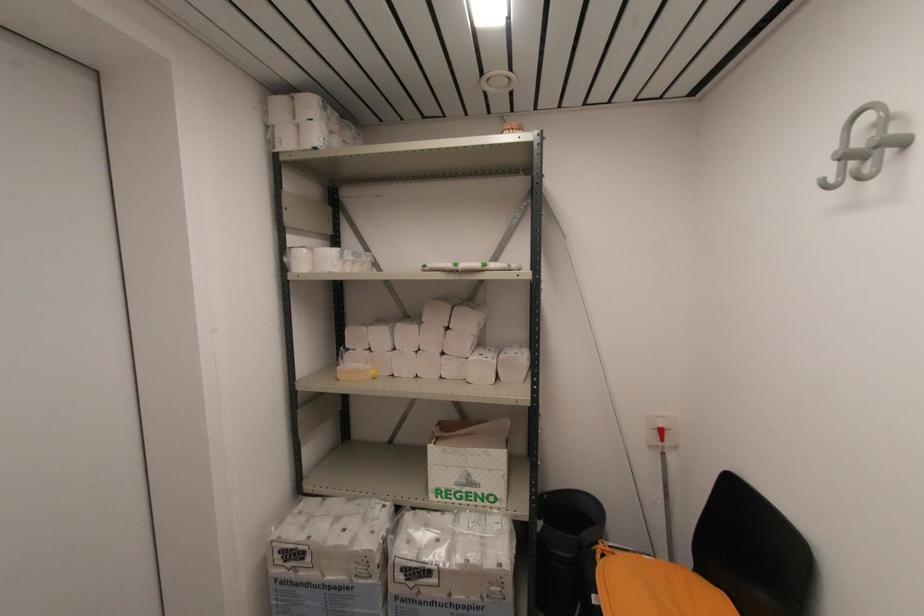
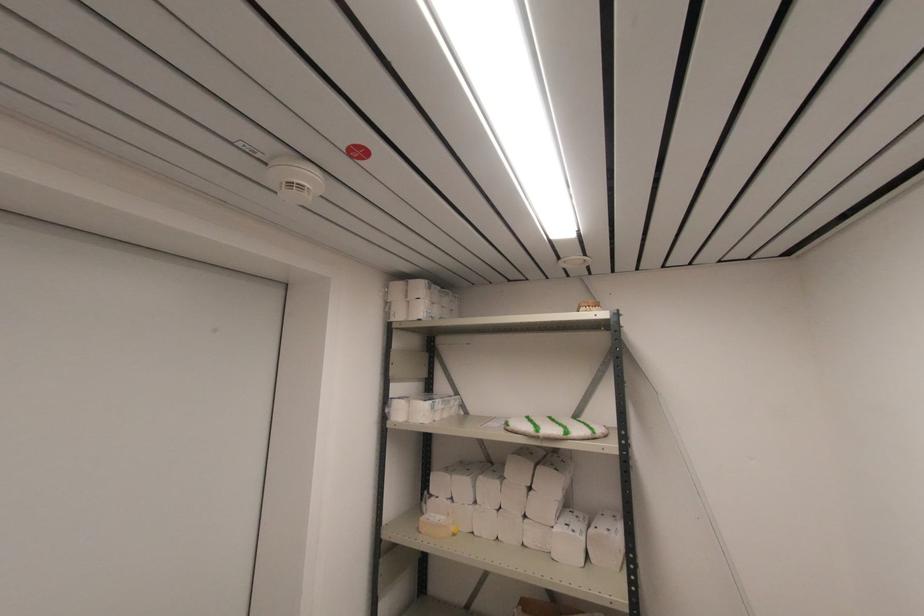
Where in the second image is the point corresponding to point (456, 269) from the first image?

(537, 436)